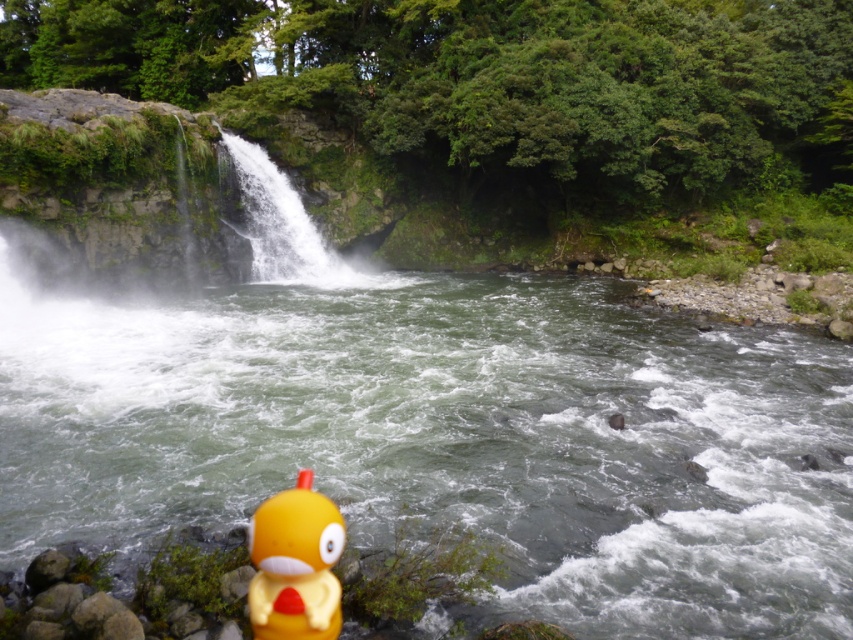
Who is more forward, (x=80, y=531) or (x=318, y=259)?

Point (x=80, y=531) is more forward.

Can you confirm if green rubber duck at lower center is thinner than white frothy water at center?

No, green rubber duck at lower center is not thinner than white frothy water at center.

Locate an element on the screen. green rubber duck at lower center is located at coordinates (450, 436).

Find the location of `green rubber duck at lower center`. green rubber duck at lower center is located at coordinates (450, 436).

Can you confirm if green rubber duck at lower center is positioned to the left of yellow rubber duck at lower left?

Correct, you'll find green rubber duck at lower center to the left of yellow rubber duck at lower left.

Can you confirm if green rubber duck at lower center is positioned above yellow rubber duck at lower left?

Correct, green rubber duck at lower center is located above yellow rubber duck at lower left.

At what (x,y) coordinates should I click in order to perform the action: click on green rubber duck at lower center. Please return your answer as a coordinate pair (x, y). The width and height of the screenshot is (853, 640). Looking at the image, I should click on (450, 436).

Does yellow rubber duck at lower left come behind white frothy water at center?

No, yellow rubber duck at lower left is closer to the viewer.

Between point (256, 625) and point (265, 250), which one is positioned in front?

Point (256, 625)

You are a GUI agent. You are given a task and a screenshot of the screen. Output one action in this format:
    pyautogui.click(x=<x>, y=<y>)
    Task: Click on the yellow rubber duck at lower left
    This screenshot has width=853, height=640.
    Given the screenshot: What is the action you would take?
    pyautogui.click(x=294, y=564)